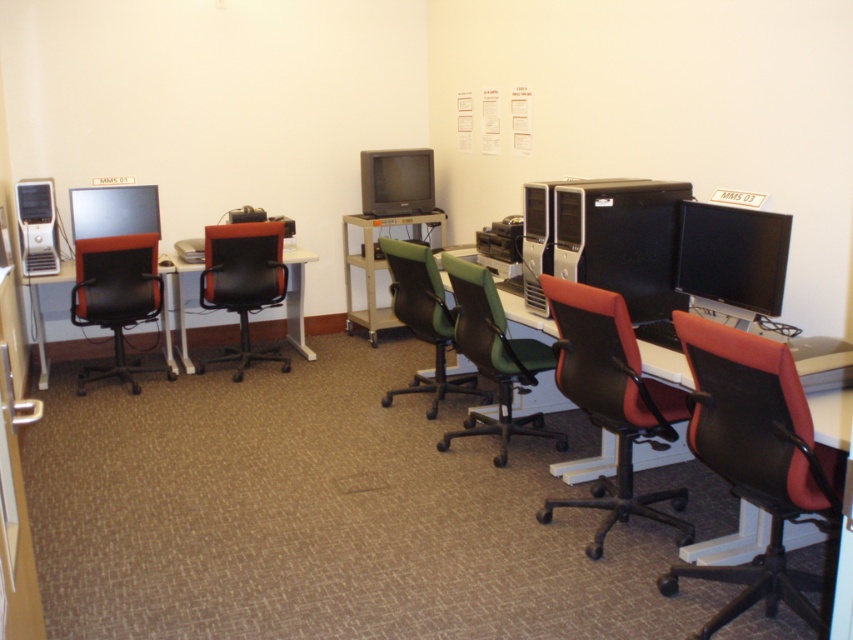
You are standing in the computer lab and need to reach the white plastic table at left to retrieve a USB drive. The lab has a strict rule that you must not walk more than 5 meters to retrieve any item. Can you safely retrieve the USB drive without violating the rule?

The white plastic table at left is 5.10 meters away from viewer, which exceeds the 5 meter limit. Therefore, you cannot safely retrieve the USB drive without violating the rule.

You are a technician in a computer lab. You need to locate the matte black monitor at right. Where is it positioned in the room?

The matte black monitor at right is positioned at point (733, 256) in the room.

You are standing in the computer lab and want to place a small plant on the white plastic table at left. The point you are aiming for is point (173, 314). Is this point on the table?

Yes, the point (173, 314) is on the white plastic table at left according to the description.